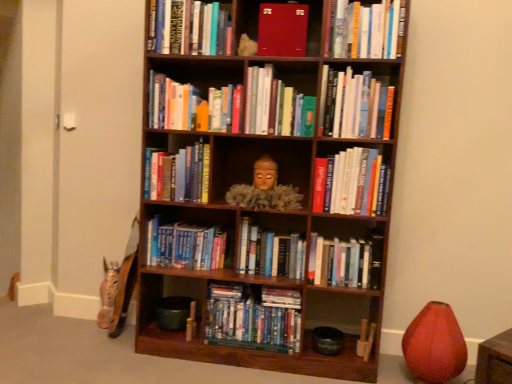
Question: From a real-world perspective, relative to hardcover books at center, the 3th book in the bottom-to-top sequence, is blue hardcover books at center, positioned as the first book in bottom-to-top order, vertically above or below?

Choices:
 (A) below
 (B) above

Answer: (A)

Question: In terms of height, does blue hardcover books at center, positioned as the first book in bottom-to-top order, look taller or shorter compared to hardcover books at center, the 3th book in the bottom-to-top sequence?

Choices:
 (A) tall
 (B) short

Answer: (B)

Question: Which object is positioned closest to the blue hardcover books at center, positioned as the first book in bottom-to-top order?

Choices:
 (A) hardcover books at center, placed as the 8th book when sorted from top to bottom
 (B) matte gold statue at center
 (C) hardcover books at upper right, the seventh book ordered from the bottom
 (D) hardcover book at upper center, positioned as the fourth book in top-to-bottom order
 (E) hardcover books at upper center, the first book positioned from the top

Answer: (B)

Question: Based on their relative distances, which object is farther from the blue hardcover books at center, the second book positioned from the bottom?

Choices:
 (A) blue hardcover books at center, positioned as the first book in bottom-to-top order
 (B) hardcover books at center, which is the 7th book in top-to-bottom order
 (C) mahogany wood bookcase at center
 (D) hardcover book at upper center, positioned as the fourth book in top-to-bottom order
 (E) hardcover books at upper center, the 10th book positioned from the bottom

Answer: (E)